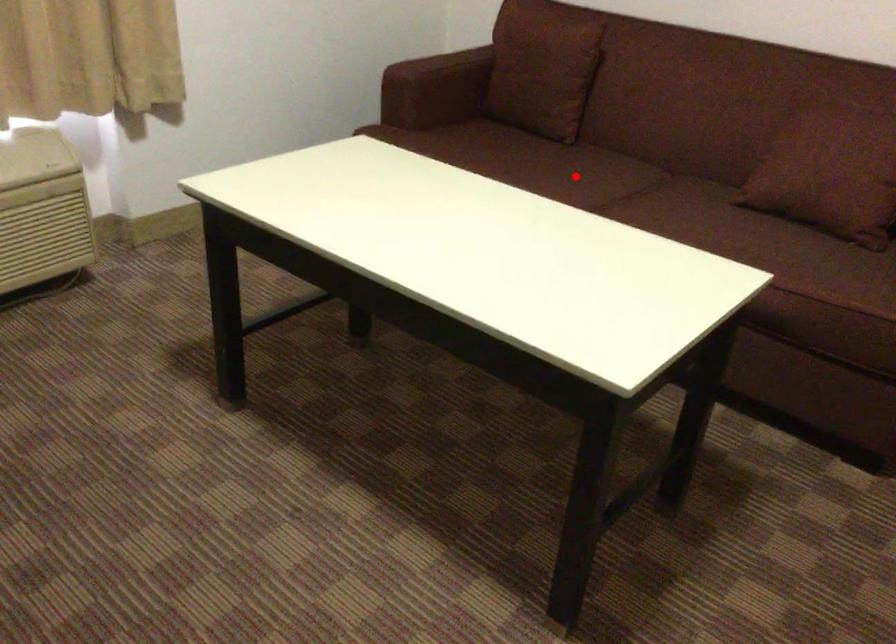
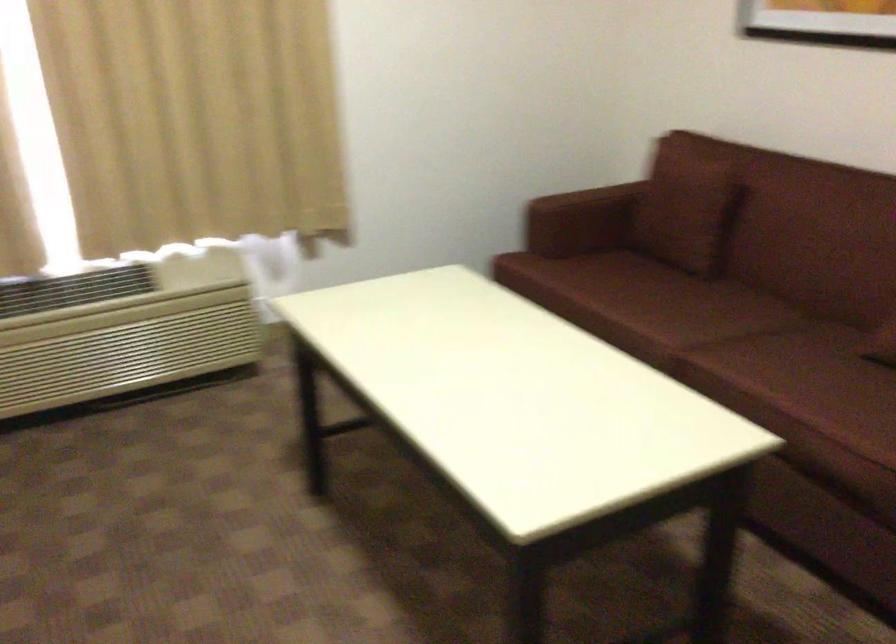
Find the pixel in the second image that matches the highlighted location in the first image.

(682, 310)